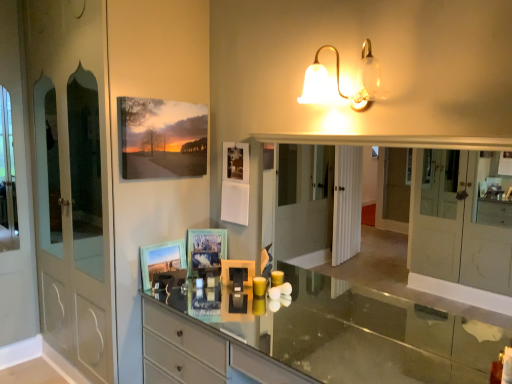
Question: From a real-world perspective, relative to matte blue picture frame at center, which appears as the 2th picture frame when ordered from the bottom, is matte glass picture frame at center, arranged as the 1th picture frame when ordered from the bottom, vertically above or below?

Choices:
 (A) above
 (B) below

Answer: (B)

Question: In terms of width, does matte glass picture frame at center, arranged as the 1th picture frame when ordered from the bottom, look wider or thinner when compared to matte blue picture frame at center, which appears as the second picture frame when viewed from the top?

Choices:
 (A) thin
 (B) wide

Answer: (B)

Question: Which object is positioned closest to the smooth glass countertop at center?

Choices:
 (A) translucent glass sconce at upper center
 (B) matte glass picture frame at center, arranged as the 1th picture frame when ordered from the bottom
 (C) matte blue picture frame at center, which appears as the second picture frame when viewed from the top
 (D) matte canvas painting at upper left, marked as the first picture frame in a top-to-bottom arrangement
 (E) clear glass mirror at center

Answer: (E)

Question: Estimate the real-world distances between objects in this image. Which object is farther from the translucent glass sconce at upper center?

Choices:
 (A) matte glass picture frame at center, the 3th picture frame in the top-to-bottom sequence
 (B) clear glass mirror at center
 (C) smooth glass countertop at center
 (D) matte blue picture frame at center, which appears as the second picture frame when viewed from the top
 (E) matte canvas painting at upper left, marked as the first picture frame in a top-to-bottom arrangement

Answer: (C)